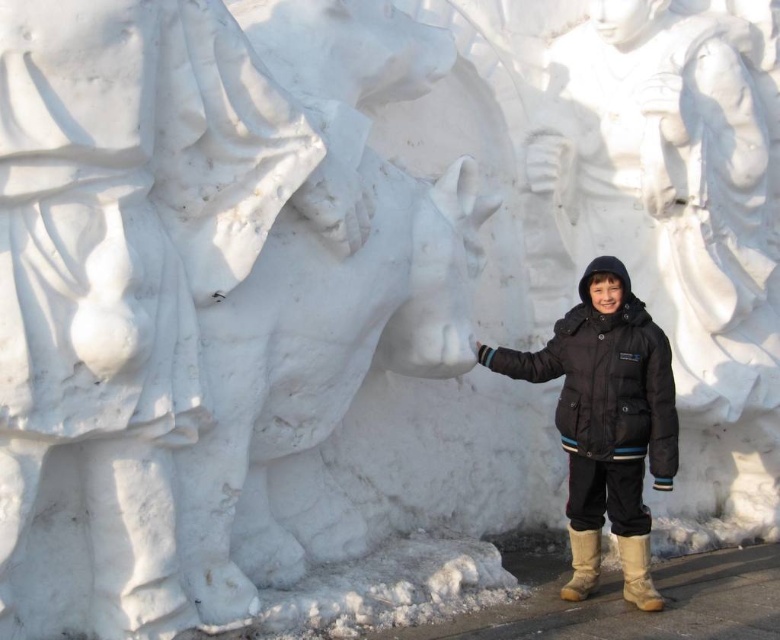
Is white marble statue at center to the right of brown suede boot at lower right from the viewer's perspective?

Yes, white marble statue at center is to the right of brown suede boot at lower right.

Which of these two, white marble statue at center or brown suede boot at lower right, stands taller?

white marble statue at center

Locate an element on the screen. white marble statue at center is located at coordinates (669, 186).

Does black matte jacket at center have a smaller size compared to brown suede boot at lower right?

No, black matte jacket at center is not smaller than brown suede boot at lower right.

At what (x,y) coordinates should I click in order to perform the action: click on black matte jacket at center. Please return your answer as a coordinate pair (x, y). This screenshot has height=640, width=780. Looking at the image, I should click on (608, 412).

Does black matte jacket at center have a smaller size compared to tan suede boot at lower right?

No.

Where is `black matte jacket at center`? black matte jacket at center is located at coordinates (608, 412).

Locate an element on the screen. This screenshot has height=640, width=780. black matte jacket at center is located at coordinates (608, 412).